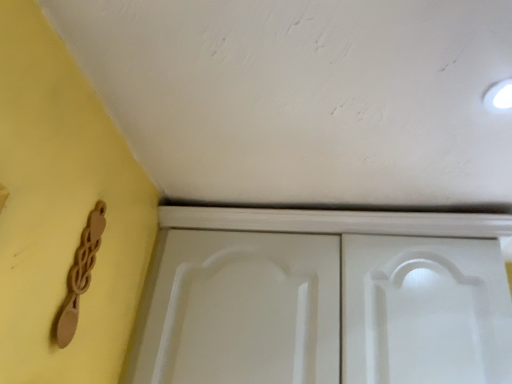
What do you see at coordinates (324, 298) in the screenshot? The height and width of the screenshot is (384, 512). I see `white matte cupboard at center` at bounding box center [324, 298].

This screenshot has width=512, height=384. I want to click on white matte cupboard at center, so click(x=324, y=298).

In order to face white matte cupboard at center, should I rotate leftwards or rightwards?

It's best to rotate right around 9.979 degrees.

The image size is (512, 384). Identify the location of wooden spoon at lower left. (80, 275).

What do you see at coordinates (80, 275) in the screenshot? I see `wooden spoon at lower left` at bounding box center [80, 275].

Find the location of a particular element. white matte cupboard at center is located at coordinates [324, 298].

Which object is positioned more to the left, white matte cupboard at center or wooden spoon at lower left?

From the viewer's perspective, wooden spoon at lower left appears more on the left side.

Considering their positions, is white matte cupboard at center located in front of or behind wooden spoon at lower left?

white matte cupboard at center is behind wooden spoon at lower left.

Which is closer, (361, 226) or (72, 324)?

Point (361, 226) is positioned farther from the camera compared to point (72, 324).

From the image's perspective, is white matte cupboard at center on wooden spoon at lower left?

Actually, white matte cupboard at center appears below wooden spoon at lower left in the image.

From a real-world perspective, between white matte cupboard at center and wooden spoon at lower left, who is vertically higher?

white matte cupboard at center, from a real-world perspective.

Which object is wider, white matte cupboard at center or wooden spoon at lower left?

white matte cupboard at center.

Between white matte cupboard at center and wooden spoon at lower left, which one has more height?

With more height is white matte cupboard at center.

Looking at this image, can you confirm if white matte cupboard at center is smaller than wooden spoon at lower left?

No.

Is wooden spoon at lower left a part of white matte cupboard at center?

Definitely not — wooden spoon at lower left is not inside white matte cupboard at center.

Is white matte cupboard at center placed right next to wooden spoon at lower left?

white matte cupboard at center is not next to wooden spoon at lower left, and they're not touching.

Is wooden spoon at lower left at the back of white matte cupboard at center?

white matte cupboard at center does not have its back to wooden spoon at lower left.

Measure the distance from white matte cupboard at center to wooden spoon at lower left.

52.42 centimeters.

This screenshot has width=512, height=384. Find the location of `door handle that is on the left side of white matte cupboard at center`. door handle that is on the left side of white matte cupboard at center is located at coordinates (80, 275).

Considering the relative positions of wooden spoon at lower left and white matte cupboard at center in the image provided, is wooden spoon at lower left to the left or to the right of white matte cupboard at center?

In the image, wooden spoon at lower left appears on the left side of white matte cupboard at center.

Does wooden spoon at lower left come behind white matte cupboard at center?

No, the depth of wooden spoon at lower left is less than that of white matte cupboard at center.

Is point (81, 294) more distant than point (219, 228)?

That is False.

From the image's perspective, who appears lower, wooden spoon at lower left or white matte cupboard at center?

From the image's view, white matte cupboard at center is below.

In the scene shown: From a real-world perspective, relative to white matte cupboard at center, is wooden spoon at lower left vertically above or below?

Clearly, from a real-world perspective, wooden spoon at lower left is below white matte cupboard at center.

Between wooden spoon at lower left and white matte cupboard at center, which one has smaller width?

wooden spoon at lower left.

Is wooden spoon at lower left taller than white matte cupboard at center?

No, wooden spoon at lower left is not taller than white matte cupboard at center.

Considering the sizes of objects wooden spoon at lower left and white matte cupboard at center in the image provided, who is bigger, wooden spoon at lower left or white matte cupboard at center?

With larger size is white matte cupboard at center.

Is white matte cupboard at center completely or partially inside wooden spoon at lower left?

No, white matte cupboard at center is located outside of wooden spoon at lower left.

Is wooden spoon at lower left next to white matte cupboard at center?

No, wooden spoon at lower left is not next to white matte cupboard at center.

Is wooden spoon at lower left aimed at white matte cupboard at center?

No, wooden spoon at lower left is not aimed at white matte cupboard at center.

How much distance is there between wooden spoon at lower left and white matte cupboard at center?

wooden spoon at lower left is 52.42 centimeters from white matte cupboard at center.

This screenshot has height=384, width=512. I want to click on door handle on the left of white matte cupboard at center, so click(80, 275).

There is a wooden spoon at lower left. In order to click on cupboard above it (from a real-world perspective) in this screenshot , I will do tap(324, 298).

Image resolution: width=512 pixels, height=384 pixels. In order to click on cupboard on the right of the wooden spoon at lower left in this screenshot , I will do `click(324, 298)`.